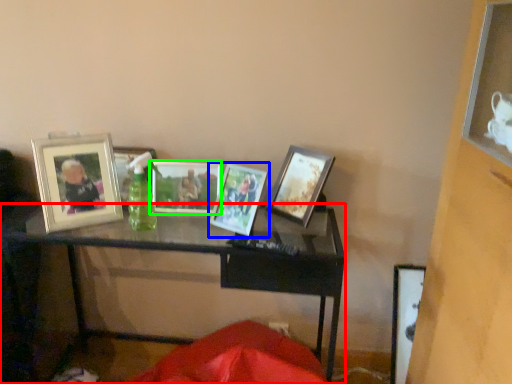
Question: Estimate the real-world distances between objects in this image. Which object is farther from table (highlighted by a red box), picture frame (highlighted by a blue box) or picture frame (highlighted by a green box)?

Choices:
 (A) picture frame
 (B) picture frame

Answer: (A)